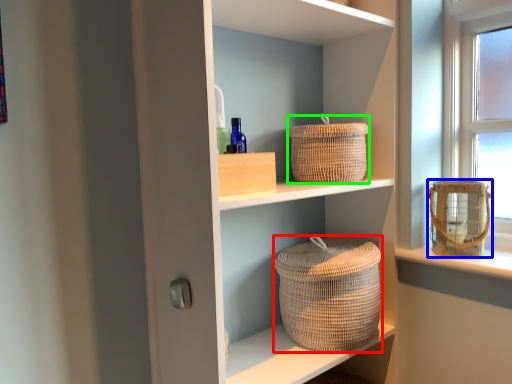
Question: Based on their relative distances, which object is nearer to basket container (highlighted by a red box)? Choose from basket container (highlighted by a blue box) and basket (highlighted by a green box).

Choices:
 (A) basket container
 (B) basket

Answer: (B)